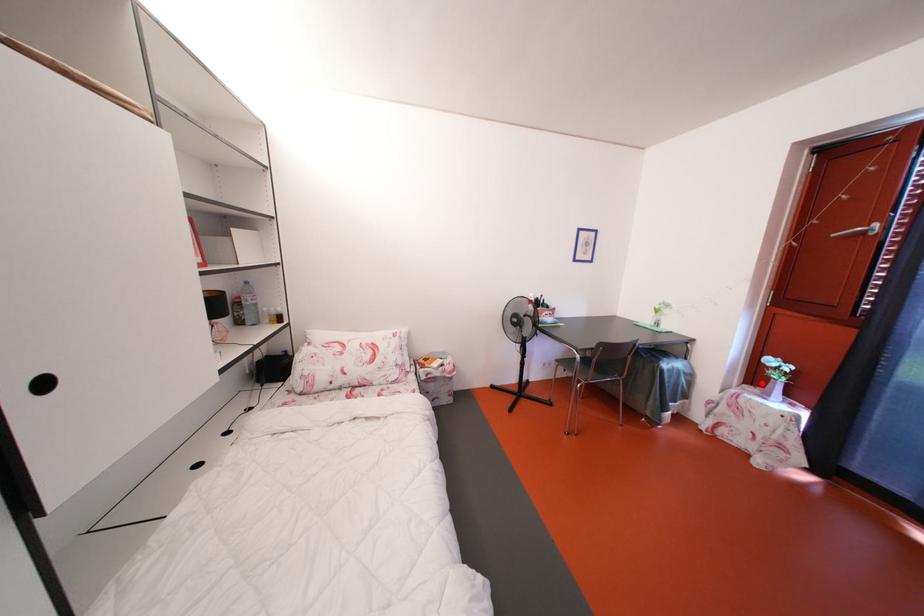
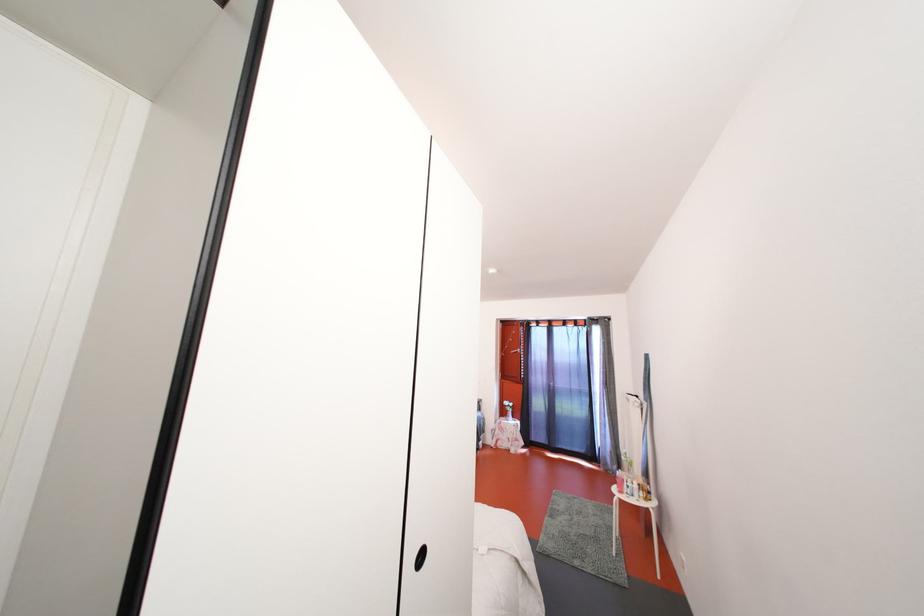
Locate, in the second image, the point that corresponds to the highlighted location in the first image.

(509, 418)